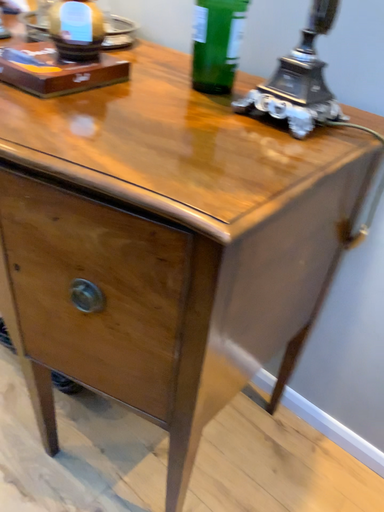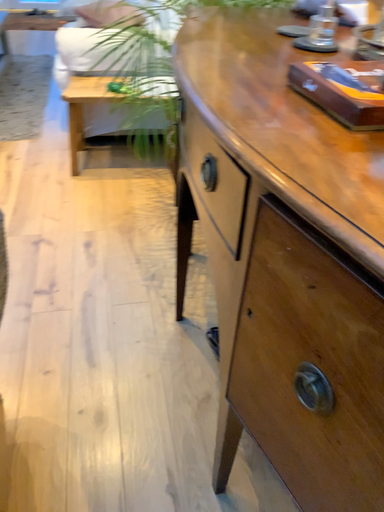
Question: How did the camera likely rotate when shooting the video?

Choices:
 (A) rotated upward
 (B) rotated downward

Answer: (A)